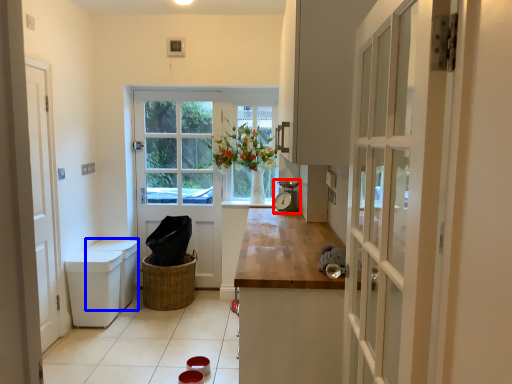
Question: Which of the following is the closest to the observer, appliance (highlighted by a red box) or cabinetry (highlighted by a blue box)?

Choices:
 (A) appliance
 (B) cabinetry

Answer: (A)